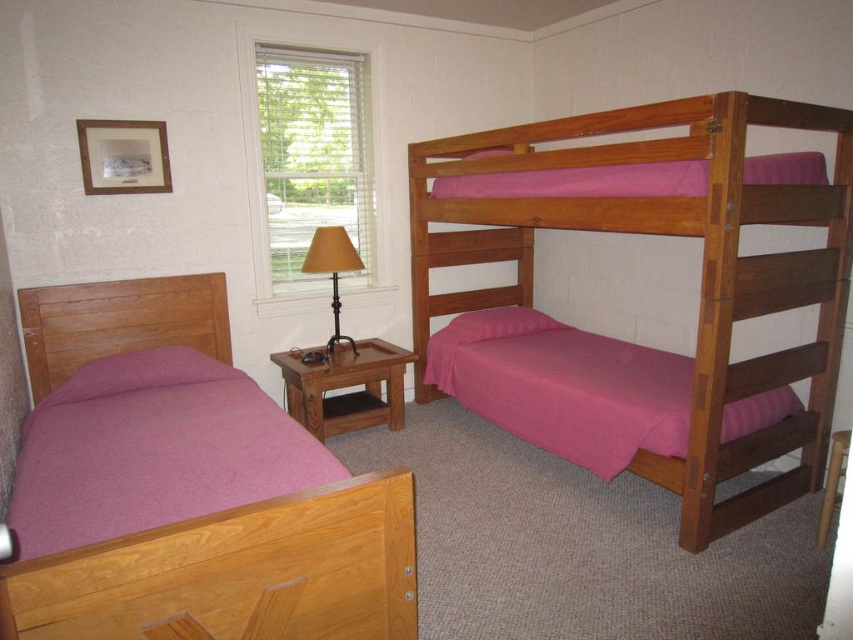
Is purple cotton blanket at lower left taller than pink fabric bed at right?

Incorrect, purple cotton blanket at lower left's height is not larger of pink fabric bed at right's.

Which is more to the left, purple cotton blanket at lower left or pink fabric bed at right?

purple cotton blanket at lower left is more to the left.

Is point (206, 504) in front of point (527, 346)?

That is True.

Locate an element on the screen. This screenshot has height=640, width=853. purple cotton blanket at lower left is located at coordinates (154, 449).

Which is below, matte wood bed at left or purple cotton blanket at lower left?

purple cotton blanket at lower left is lower down.

Between matte wood bed at left and purple cotton blanket at lower left, which one appears on the left side from the viewer's perspective?

matte wood bed at left

This screenshot has height=640, width=853. In order to click on matte wood bed at left in this screenshot , I will do `click(236, 572)`.

The height and width of the screenshot is (640, 853). Find the location of `matte wood bed at left`. matte wood bed at left is located at coordinates (236, 572).

Who is positioned more to the left, purple cotton blanket at lower left or matte gold lamp at center?

purple cotton blanket at lower left

Where is `purple cotton blanket at lower left`? The height and width of the screenshot is (640, 853). purple cotton blanket at lower left is located at coordinates (154, 449).

At what (x,y) coordinates should I click in order to perform the action: click on purple cotton blanket at lower left. Please return your answer as a coordinate pair (x, y). The height and width of the screenshot is (640, 853). Looking at the image, I should click on tap(154, 449).